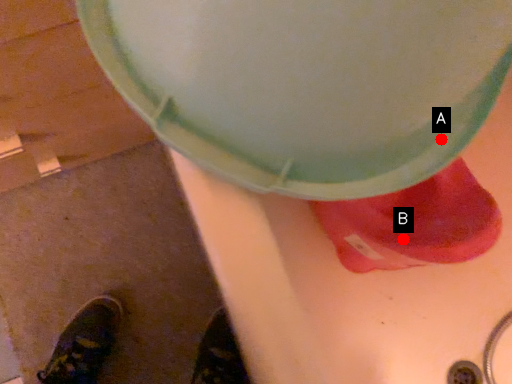
Question: Two points are circled on the image, labeled by A and B beside each circle. Which point is further to the camera?

Choices:
 (A) A is further
 (B) B is further

Answer: (B)